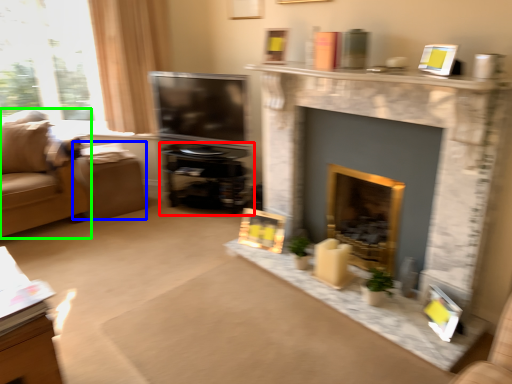
Question: Based on their relative distances, which object is nearer to entertainment center (highlighted by a red box)? Choose from footrest (highlighted by a blue box) and studio couch (highlighted by a green box).

Choices:
 (A) footrest
 (B) studio couch

Answer: (A)